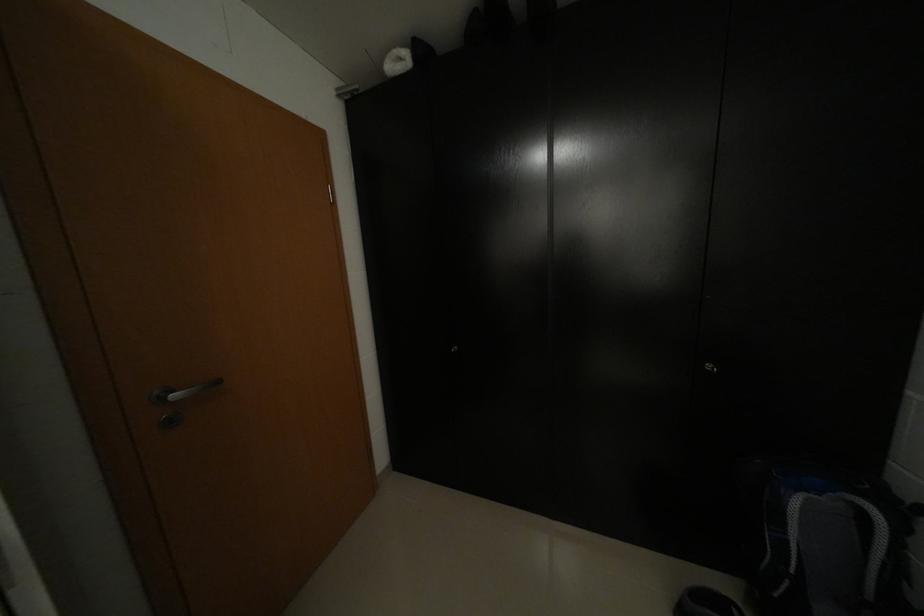
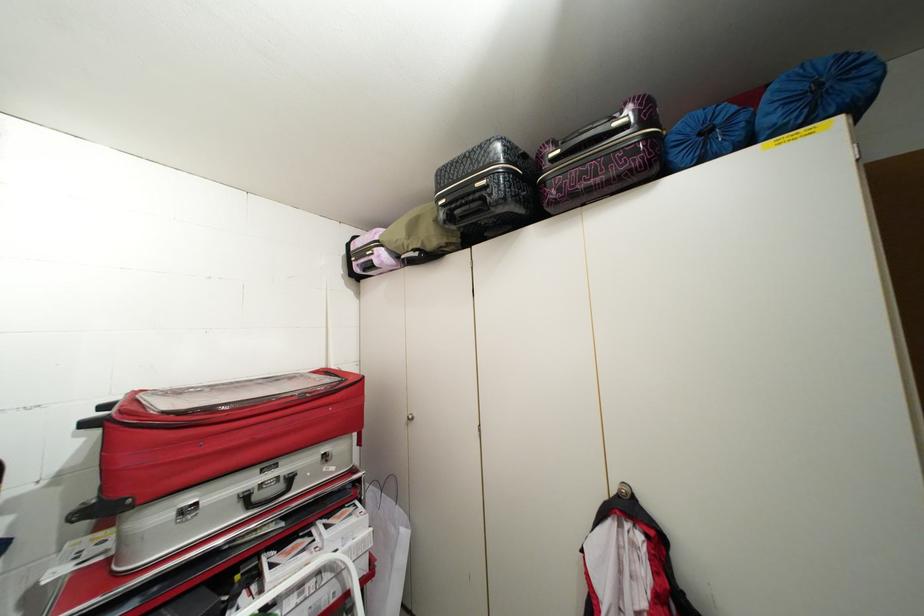
Question: The camera is either moving clockwise (left) or counter-clockwise (right) around the object. The first image is from the beginning of the video and the second image is from the end. Is the camera moving left or right when shooting the video?

Choices:
 (A) Left
 (B) Right

Answer: (B)